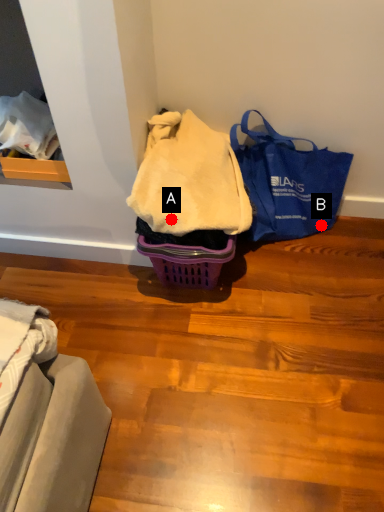
Question: Two points are circled on the image, labeled by A and B beside each circle. Which point is farther from the camera taking this photo?

Choices:
 (A) A is further
 (B) B is further

Answer: (B)